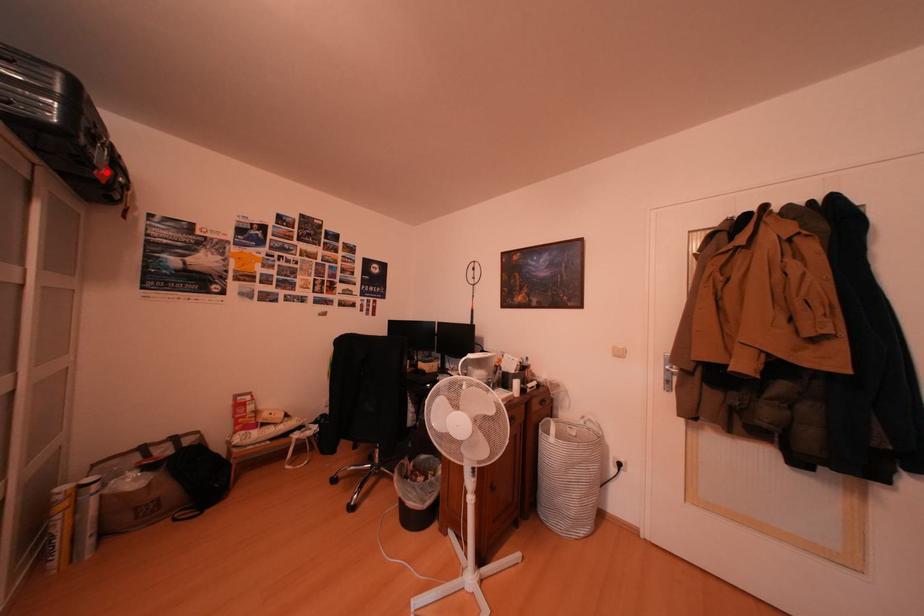
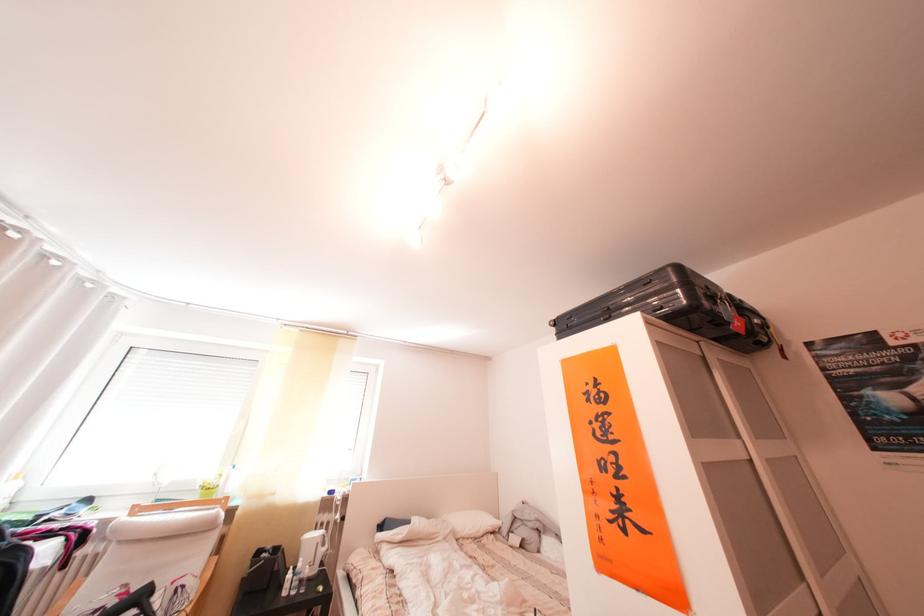
Find the pixel in the second image that matches the highlighted location in the first image.

(742, 329)